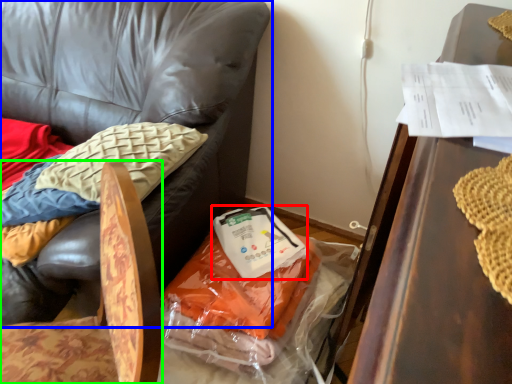
Question: Which object is positioned farthest from food (highlighted by a red box)? Select from chair (highlighted by a blue box) and chair (highlighted by a green box).

Choices:
 (A) chair
 (B) chair

Answer: (B)